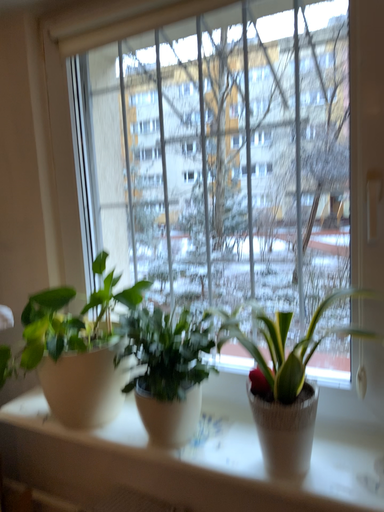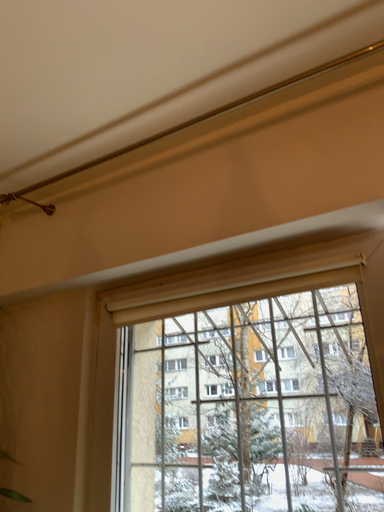
Question: How did the camera likely rotate when shooting the video?

Choices:
 (A) rotated downward
 (B) rotated upward

Answer: (B)